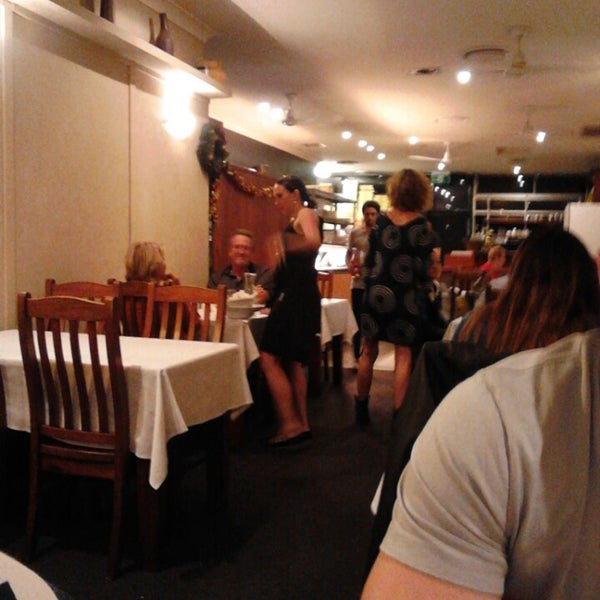
Locate an element on the screen. shelf is located at coordinates (116, 37).